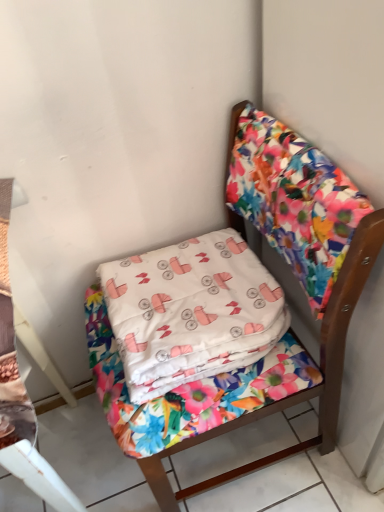
This screenshot has height=512, width=384. What do you see at coordinates (297, 392) in the screenshot?
I see `floral fabric chair at center` at bounding box center [297, 392].

Find the location of `floral fabric chair at center`. floral fabric chair at center is located at coordinates (297, 392).

This screenshot has height=512, width=384. Find the location of `white fabric pillow at center`. white fabric pillow at center is located at coordinates (191, 312).

Describe the element at coordinates (191, 312) in the screenshot. I see `white fabric pillow at center` at that location.

Identify the location of floral fabric chair at center. The height and width of the screenshot is (512, 384). (297, 392).

Considering the relative positions of floral fabric chair at center and white fabric pillow at center in the image provided, is floral fabric chair at center to the left or to the right of white fabric pillow at center?

floral fabric chair at center is to the right of white fabric pillow at center.

Considering the relative positions of floral fabric chair at center and white fabric pillow at center in the image provided, is floral fabric chair at center in front of white fabric pillow at center?

Yes, floral fabric chair at center is in front of white fabric pillow at center.

Is point (374, 214) more distant than point (248, 252)?

No, (374, 214) is in front of (248, 252).

From the image's perspective, is floral fabric chair at center under white fabric pillow at center?

Indeed, from the image's perspective, floral fabric chair at center is shown beneath white fabric pillow at center.

From a real-world perspective, is floral fabric chair at center physically located above or below white fabric pillow at center?

floral fabric chair at center is below white fabric pillow at center.

Does floral fabric chair at center have a greater width compared to white fabric pillow at center?

Indeed, floral fabric chair at center has a greater width compared to white fabric pillow at center.

Considering the relative sizes of floral fabric chair at center and white fabric pillow at center in the image provided, is floral fabric chair at center shorter than white fabric pillow at center?

In fact, floral fabric chair at center may be taller than white fabric pillow at center.

Looking at this image, does floral fabric chair at center have a smaller size compared to white fabric pillow at center?

No, floral fabric chair at center is not smaller than white fabric pillow at center.

Can we say floral fabric chair at center lies outside white fabric pillow at center?

Yes, floral fabric chair at center is outside of white fabric pillow at center.

Is the surface of floral fabric chair at center in direct contact with white fabric pillow at center?

Result: No.

Could you tell me if floral fabric chair at center is facing white fabric pillow at center?

Yes, floral fabric chair at center is oriented towards white fabric pillow at center.

The height and width of the screenshot is (512, 384). Find the location of `chair in front of the white fabric pillow at center`. chair in front of the white fabric pillow at center is located at coordinates (297, 392).

Considering the positions of objects white fabric pillow at center and floral fabric chair at center in the image provided, who is more to the right, white fabric pillow at center or floral fabric chair at center?

floral fabric chair at center.

Is the depth of white fabric pillow at center greater than that of floral fabric chair at center?

Yes, the depth of white fabric pillow at center is greater than that of floral fabric chair at center.

Does point (201, 350) lie in front of point (179, 490)?

Yes.

From the image's perspective, which one is positioned higher, white fabric pillow at center or floral fabric chair at center?

From the image's view, white fabric pillow at center is above.

From a real-world perspective, which is physically below, white fabric pillow at center or floral fabric chair at center?

From a 3D spatial view, floral fabric chair at center is below.

Between white fabric pillow at center and floral fabric chair at center, which one has larger width?

With larger width is floral fabric chair at center.

Considering the sizes of white fabric pillow at center and floral fabric chair at center in the image, is white fabric pillow at center taller or shorter than floral fabric chair at center?

Clearly, white fabric pillow at center is shorter compared to floral fabric chair at center.

Based on the photo, looking at the image, does white fabric pillow at center seem bigger or smaller compared to floral fabric chair at center?

white fabric pillow at center is smaller than floral fabric chair at center.

Could floral fabric chair at center be considered to be inside white fabric pillow at center?

No, floral fabric chair at center is not a part of white fabric pillow at center.

Is white fabric pillow at center not close to floral fabric chair at center?

white fabric pillow at center is near floral fabric chair at center, not far away.

Could you tell me if white fabric pillow at center is facing floral fabric chair at center?

Yes, white fabric pillow at center is oriented towards floral fabric chair at center.

Where is `pillow on the left of floral fabric chair at center`? This screenshot has height=512, width=384. pillow on the left of floral fabric chair at center is located at coordinates (191, 312).

Where is `chair on the right of white fabric pillow at center`? This screenshot has width=384, height=512. chair on the right of white fabric pillow at center is located at coordinates (297, 392).

Where is `pillow positioned vertically above the floral fabric chair at center (from a real-world perspective)`? The width and height of the screenshot is (384, 512). pillow positioned vertically above the floral fabric chair at center (from a real-world perspective) is located at coordinates (191, 312).